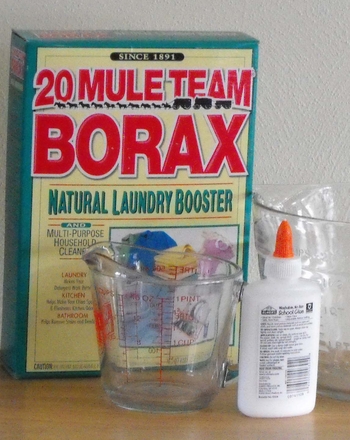
Identify the location of wall. The image size is (350, 440). (311, 132).